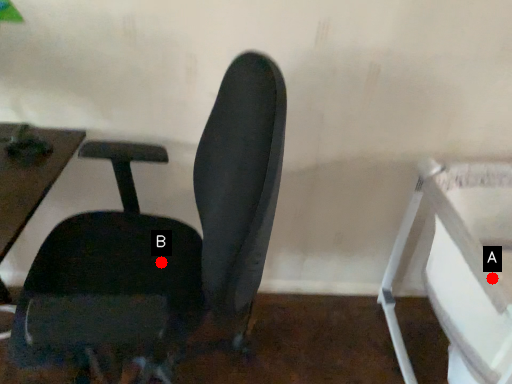
Question: Two points are circled on the image, labeled by A and B beside each circle. Which point is farther to the camera?

Choices:
 (A) A is further
 (B) B is further

Answer: (B)